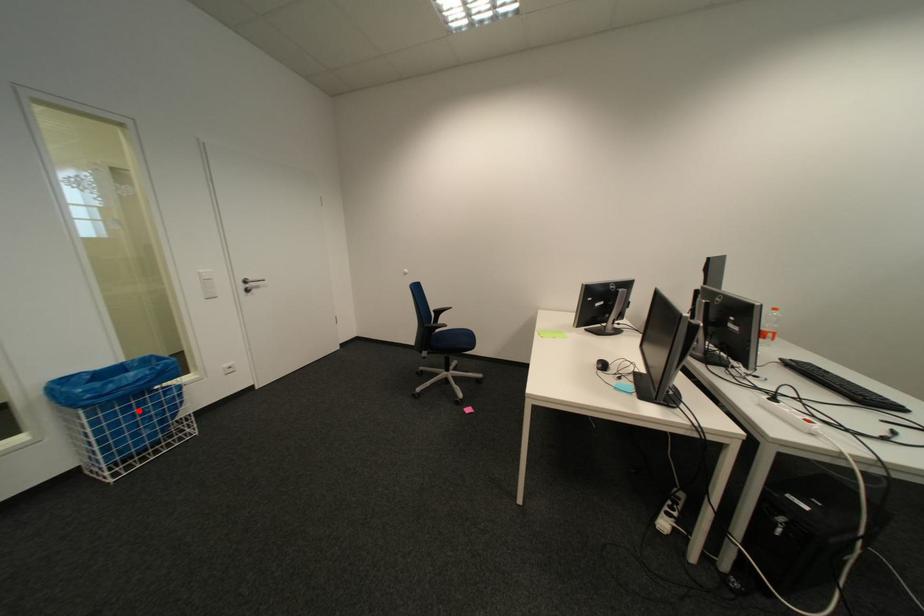
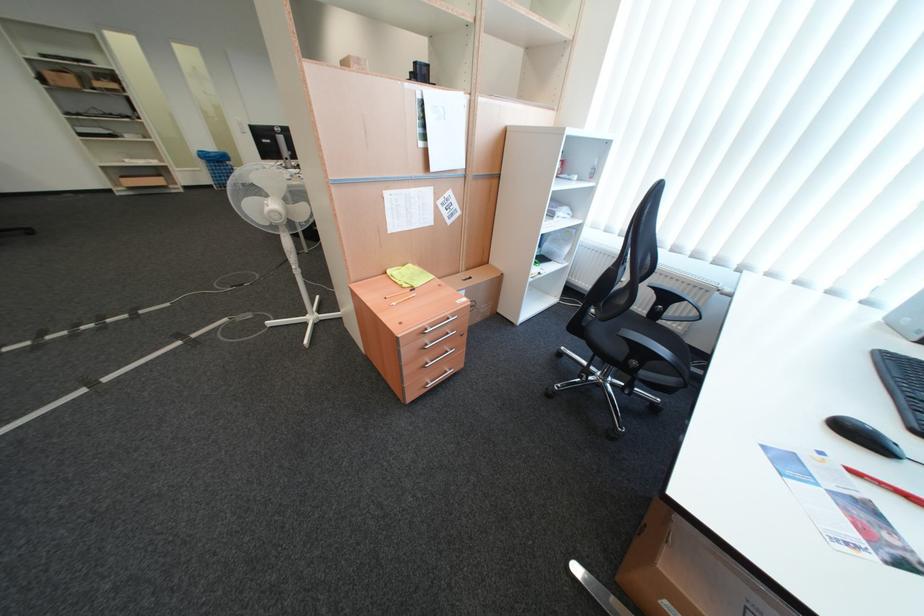
Where in the second image is the point corresponding to the highlighted location from the first image?

(227, 168)